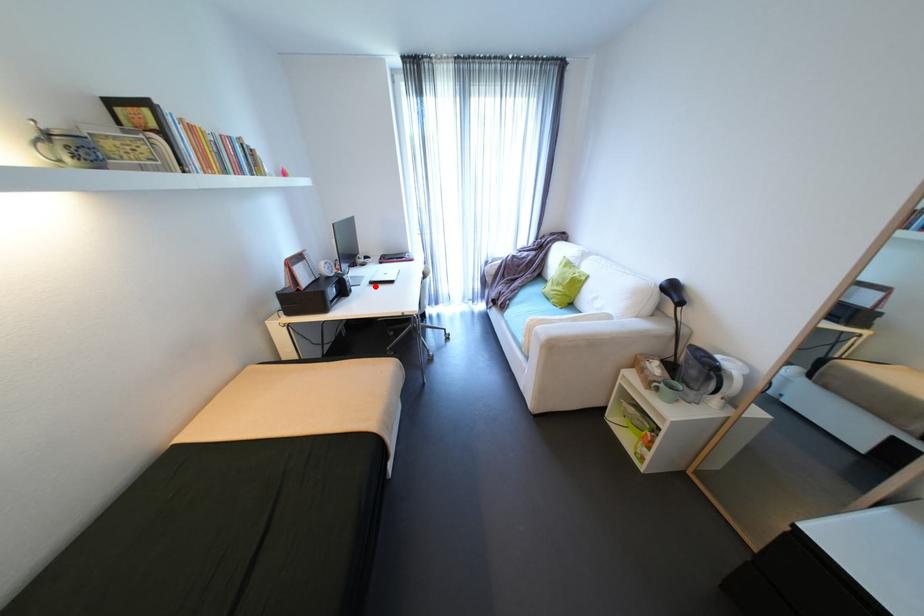
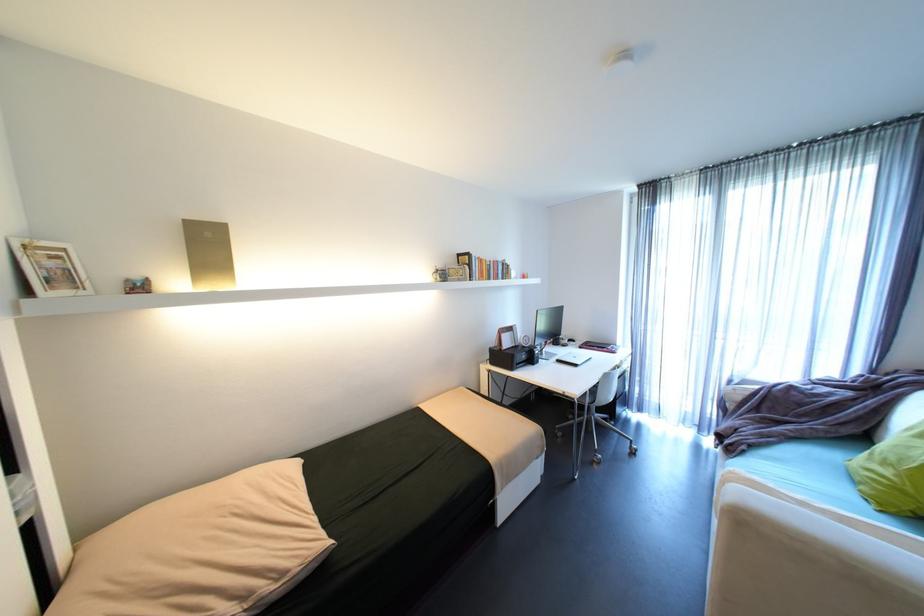
In the second image, find the point that corresponds to the highlighted location in the first image.

(562, 363)